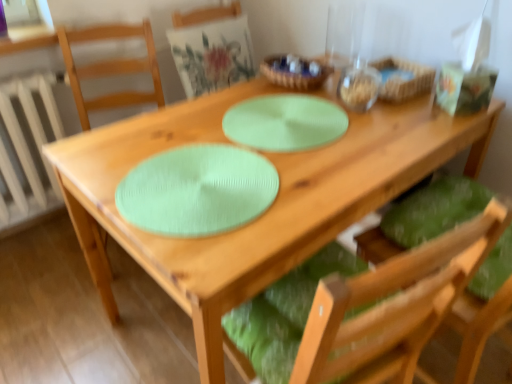
Locate an element on the screen. The width and height of the screenshot is (512, 384). vacant space to the right of green textured placemat at center is located at coordinates tap(393, 128).